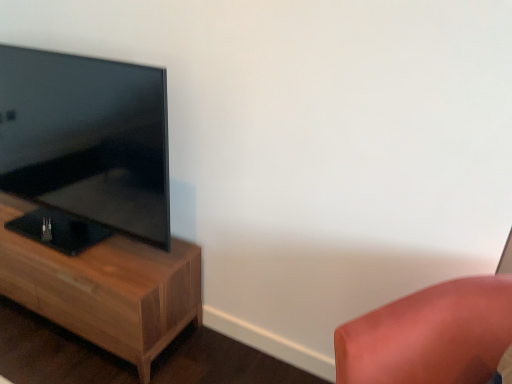
Question: From the image's perspective, is wooden nightstand at left below matte black tv at left?

Choices:
 (A) no
 (B) yes

Answer: (B)

Question: Considering the relative positions of wooden nightstand at left and matte black tv at left in the image provided, is wooden nightstand at left to the left of matte black tv at left from the viewer's perspective?

Choices:
 (A) yes
 (B) no

Answer: (A)

Question: From a real-world perspective, is wooden nightstand at left physically above matte black tv at left?

Choices:
 (A) no
 (B) yes

Answer: (A)

Question: From the image's perspective, would you say wooden nightstand at left is positioned over matte black tv at left?

Choices:
 (A) no
 (B) yes

Answer: (A)

Question: Are wooden nightstand at left and matte black tv at left beside each other?

Choices:
 (A) no
 (B) yes

Answer: (A)

Question: In terms of height, does matte black tv at left look taller or shorter compared to wooden nightstand at left?

Choices:
 (A) short
 (B) tall

Answer: (B)

Question: From the image's perspective, is matte black tv at left positioned above or below wooden nightstand at left?

Choices:
 (A) below
 (B) above

Answer: (B)

Question: Relative to wooden nightstand at left, is matte black tv at left in front or behind?

Choices:
 (A) front
 (B) behind

Answer: (A)

Question: Is point (156, 162) positioned closer to the camera than point (179, 273)?

Choices:
 (A) farther
 (B) closer

Answer: (B)

Question: Relative to satin pink cushion at lower right, is wooden nightstand at left in front or behind?

Choices:
 (A) front
 (B) behind

Answer: (B)

Question: Is wooden nightstand at left bigger or smaller than satin pink cushion at lower right?

Choices:
 (A) small
 (B) big

Answer: (B)

Question: From a real-world perspective, is wooden nightstand at left positioned above or below satin pink cushion at lower right?

Choices:
 (A) below
 (B) above

Answer: (A)

Question: From the image's perspective, is wooden nightstand at left positioned above or below satin pink cushion at lower right?

Choices:
 (A) above
 (B) below

Answer: (A)

Question: Which is correct: matte black tv at left is inside satin pink cushion at lower right, or outside of it?

Choices:
 (A) inside
 (B) outside

Answer: (B)

Question: From the image's perspective, is matte black tv at left above or below satin pink cushion at lower right?

Choices:
 (A) below
 (B) above

Answer: (B)